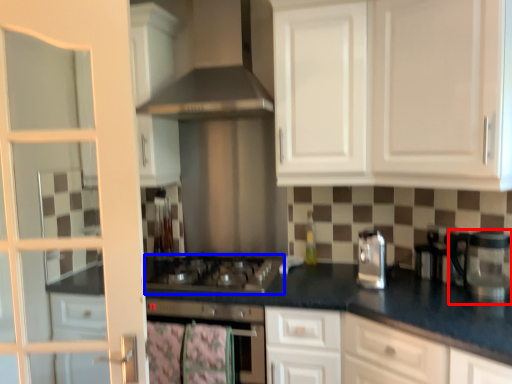
Question: Which object appears farthest to the camera in this image, coffee machine (highlighted by a red box) or gas stove (highlighted by a blue box)?

Choices:
 (A) coffee machine
 (B) gas stove

Answer: (B)